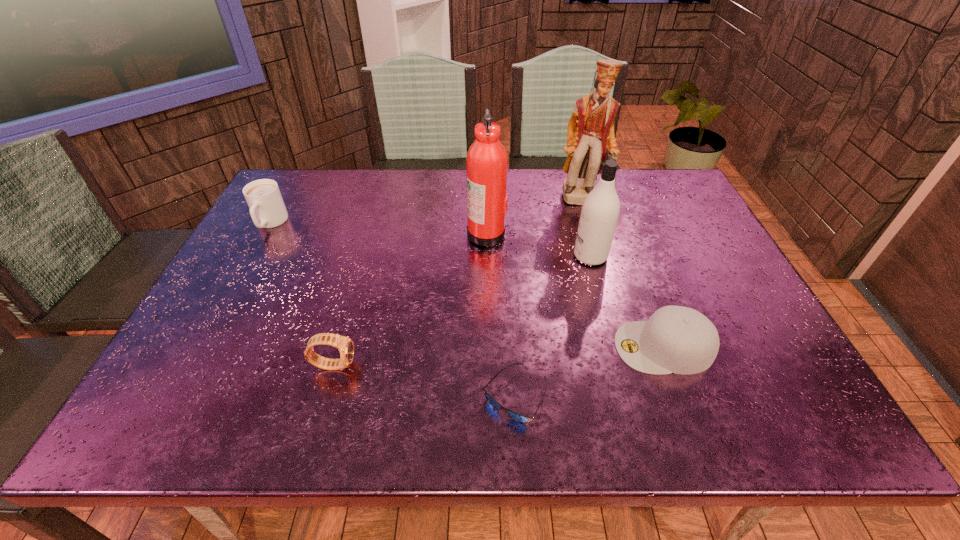
Locate an element on the screen. nutcracker positioned at the far edge is located at coordinates (590, 133).

You are a GUI agent. You are given a task and a screenshot of the screen. Output one action in this format:
    pyautogui.click(x=<x>, y=<y>)
    Task: Click on the cappuccino at the far edge
    This screenshot has height=540, width=960.
    Given the screenshot: What is the action you would take?
    pyautogui.click(x=267, y=209)

You are a GUI agent. You are given a task and a screenshot of the screen. Output one action in this format:
    pyautogui.click(x=<x>, y=<y>)
    Task: Click on the object that is at the near edge
    
    Given the screenshot: What is the action you would take?
    pyautogui.click(x=518, y=417)

Find the location of a particular element. object that is at the left edge is located at coordinates (267, 209).

Where is `object present at the right edge`? This screenshot has height=540, width=960. object present at the right edge is located at coordinates (676, 339).

Find the location of a particular element. object at the far left corner is located at coordinates (267, 209).

The height and width of the screenshot is (540, 960). What are the coordinates of `vacant area at the far edge of the desktop` in the screenshot? It's located at (427, 173).

I want to click on vacant space at the near edge, so click(564, 434).

Identify the location of free space at the left edge of the desktop. This screenshot has height=540, width=960. (275, 249).

Where is `vacant space at the right edge`? This screenshot has width=960, height=540. vacant space at the right edge is located at coordinates (712, 288).